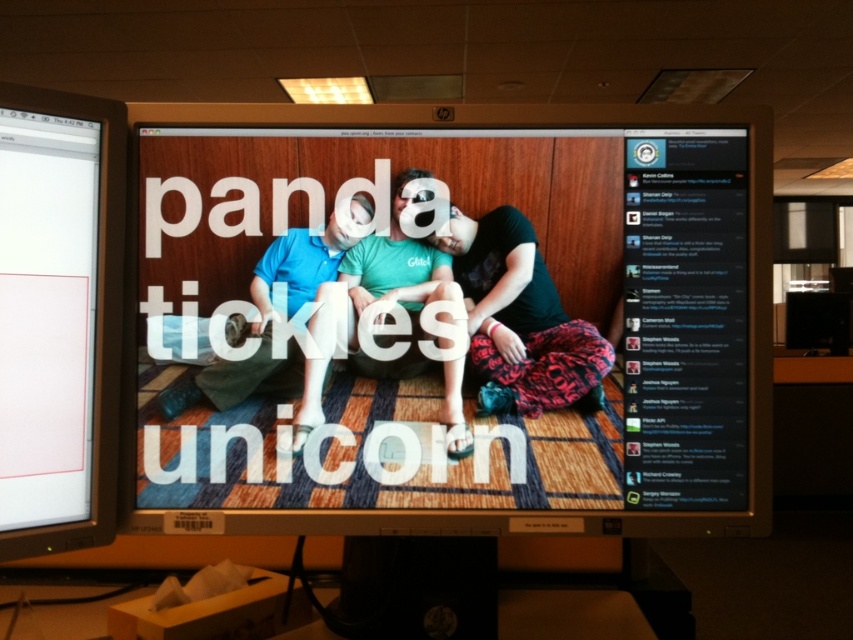
Question: Does matte black monitor at center appear on the left side of matte green t-shirt at center?

Choices:
 (A) yes
 (B) no

Answer: (B)

Question: Which point is closer to the camera?

Choices:
 (A) (186, 189)
 (B) (518, 387)
 (C) (381, 282)

Answer: (A)

Question: Can you confirm if matte black monitor at center is smaller than matte black shirt at center?

Choices:
 (A) yes
 (B) no

Answer: (B)

Question: Which point is closer to the camera taking this photo?

Choices:
 (A) (461, 236)
 (B) (201, 376)
 (C) (498, 268)
 (D) (693, 253)

Answer: (D)

Question: Which object is the farthest from the matte black monitor at center?

Choices:
 (A) matte green shirt at center
 (B) blue cotton shirt at center
 (C) matte black monitor at left

Answer: (C)

Question: Is matte black shirt at center below matte green t-shirt at center?

Choices:
 (A) no
 (B) yes

Answer: (A)